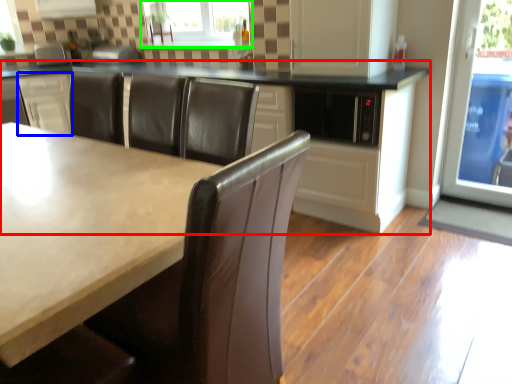
Question: Estimate the real-world distances between objects in this image. Which object is farther from cabinetry (highlighted by a red box), cabinetry (highlighted by a blue box) or window (highlighted by a green box)?

Choices:
 (A) cabinetry
 (B) window

Answer: (A)